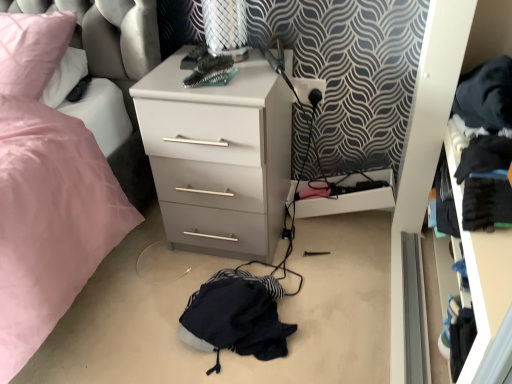
In order to click on vacant space positioned to the left of matte gray chest of drawers at center in this screenshot , I will do coord(131,258).